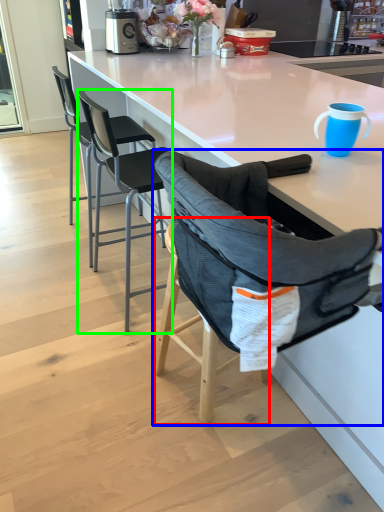
Question: Which is farther away from bar stool (highlighted by a red box)? chair (highlighted by a blue box) or chair (highlighted by a green box)?

Choices:
 (A) chair
 (B) chair

Answer: (B)